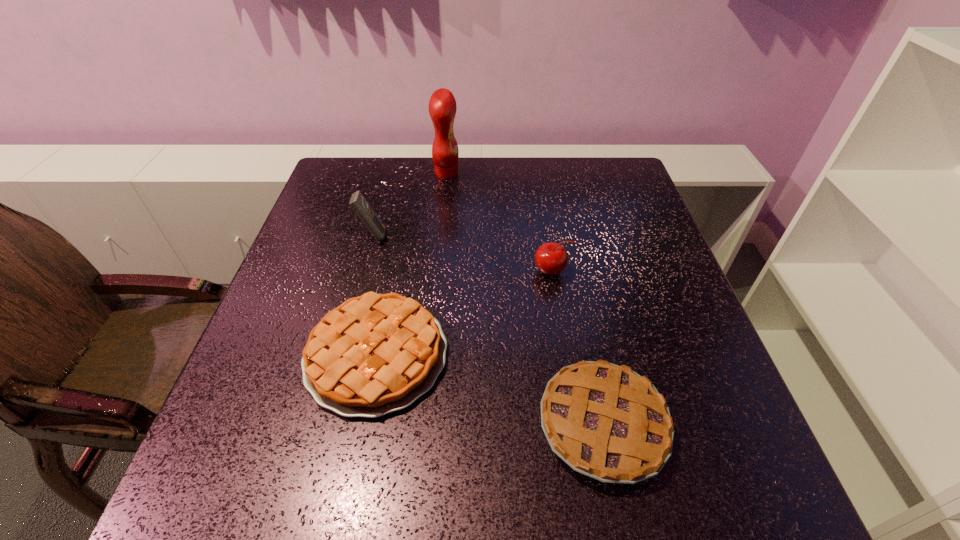
Locate an element on the screen. condiment is located at coordinates (442, 106).

Find the location of a particular element. The image size is (960, 540). the tallest object is located at coordinates (442, 106).

Locate an element on the screen. the fourth shortest object is located at coordinates (362, 208).

Identify the location of the second farthest object. This screenshot has height=540, width=960. (362, 208).

Where is `the third tallest object`? The image size is (960, 540). the third tallest object is located at coordinates (551, 258).

The width and height of the screenshot is (960, 540). What are the coordinates of `the third nearest object` in the screenshot? It's located at (551, 258).

What are the coordinates of `the left pie` in the screenshot? It's located at (374, 354).

Locate an element on the screen. The height and width of the screenshot is (540, 960). the right pie is located at coordinates (606, 421).

This screenshot has height=540, width=960. In order to click on vacant space located on the label side of the farthest object in this screenshot , I will do `click(546, 173)`.

Image resolution: width=960 pixels, height=540 pixels. I want to click on vacant space situated on the front-facing side of the second farthest object, so click(518, 236).